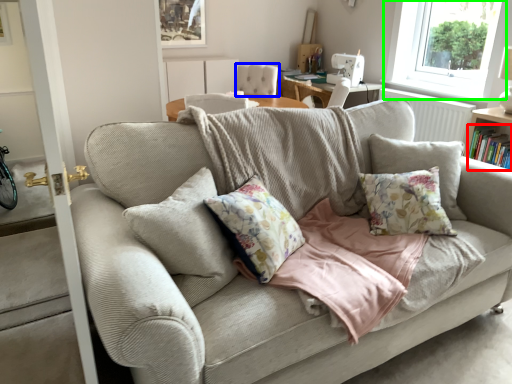
Question: Which object is positioned closest to book (highlighted by a red box)? Select from armchair (highlighted by a blue box) and window (highlighted by a green box).

Choices:
 (A) armchair
 (B) window

Answer: (A)